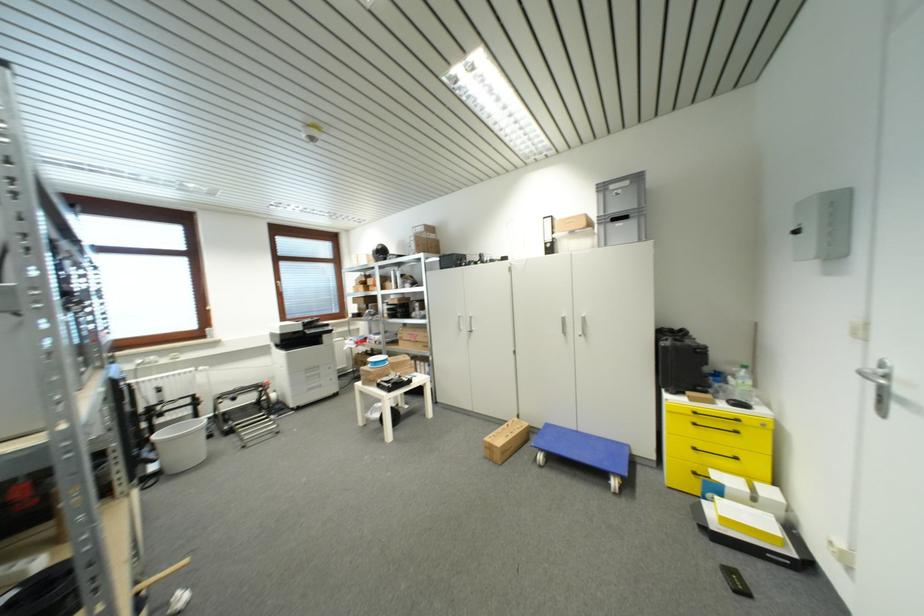
The width and height of the screenshot is (924, 616). What do you see at coordinates (736, 581) in the screenshot?
I see `a black remote control` at bounding box center [736, 581].